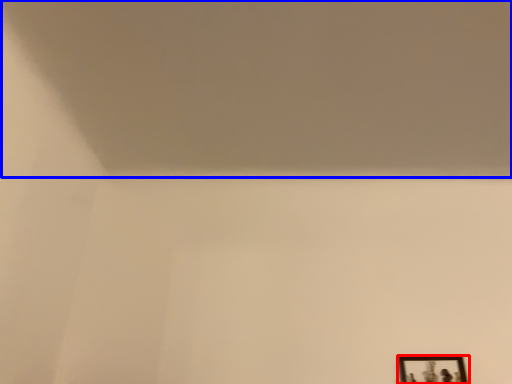
Question: Which object appears farthest to the camera in this image, picture frame (highlighted by a red box) or wide (highlighted by a blue box)?

Choices:
 (A) picture frame
 (B) wide

Answer: (A)